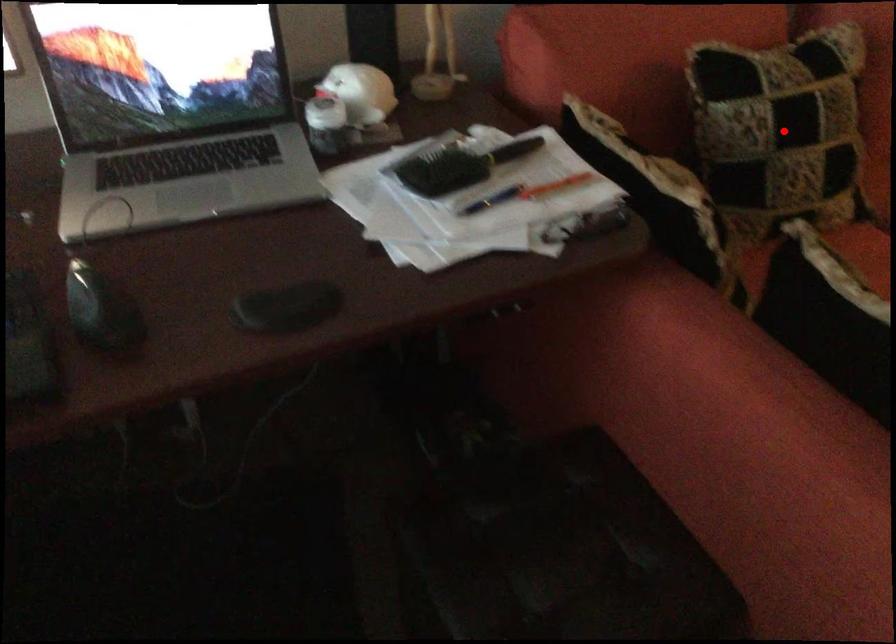
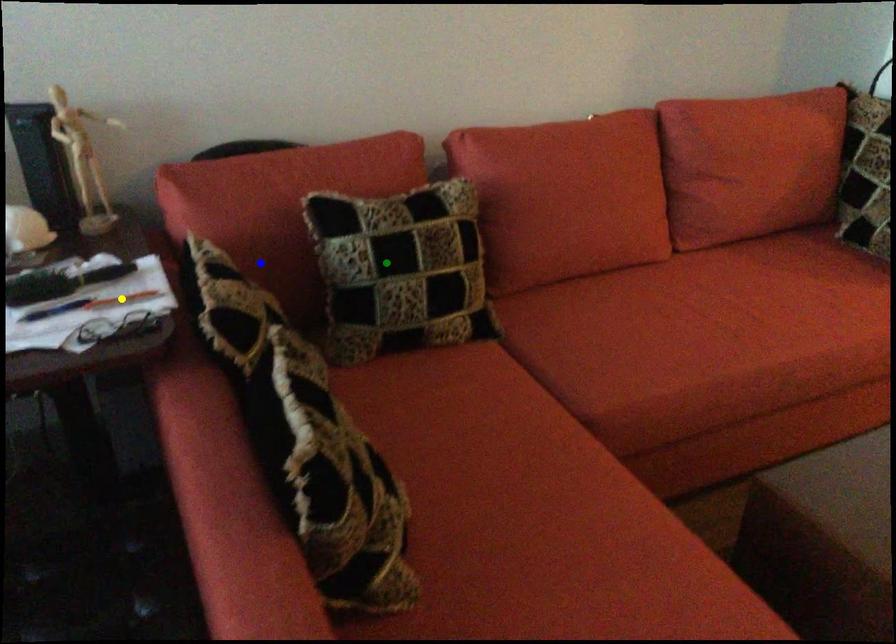
Question: I am providing you with two images of the same scene from different viewpoints. A red point is marked on the first image. You are given multiple points on the second image. In image 2, which mark is for the same physical point as the one in image 1?

Choices:
 (A) green point
 (B) blue point
 (C) yellow point

Answer: (A)